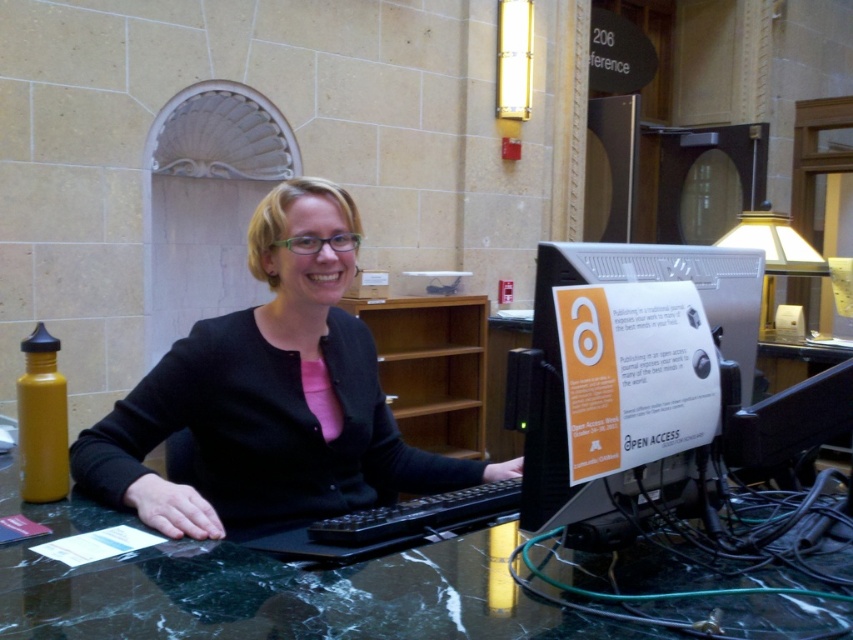
Question: Is marble table at center above silver metallic computer monitor at center?

Choices:
 (A) yes
 (B) no

Answer: (B)

Question: Where is black matte sweater at center located in relation to silver metallic computer monitor at center in the image?

Choices:
 (A) below
 (B) above

Answer: (A)

Question: Which object is farther from the camera taking this photo?

Choices:
 (A) silver metallic computer monitor at center
 (B) black matte sweater at center
 (C) marble table at center

Answer: (B)

Question: Does black matte sweater at center lie in front of silver metallic computer monitor at center?

Choices:
 (A) no
 (B) yes

Answer: (A)

Question: Which point is farther to the camera?

Choices:
 (A) black matte sweater at center
 (B) marble table at center
 (C) silver metallic computer monitor at center

Answer: (A)

Question: Which of the following is the closest to the observer?

Choices:
 (A) silver metallic computer monitor at center
 (B) black matte sweater at center
 (C) marble table at center

Answer: (C)